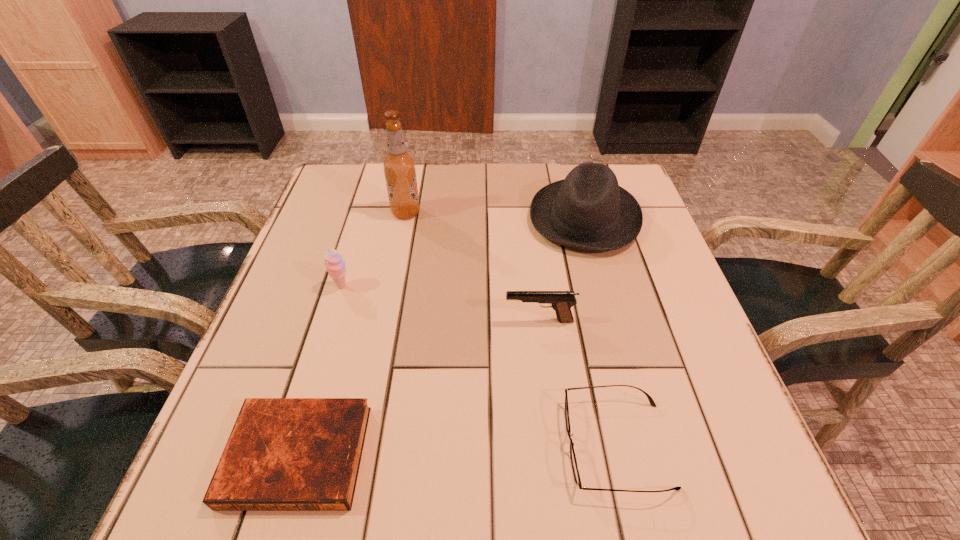
Identify the location of the tallest object. The image size is (960, 540). click(x=399, y=166).

Identify the location of fedora. This screenshot has height=540, width=960. (588, 210).

Locate an element on the screen. the fourth nearest object is located at coordinates (334, 262).

Where is `the third tallest object`? the third tallest object is located at coordinates (334, 262).

Locate an element on the screen. The image size is (960, 540). the third shortest object is located at coordinates (561, 301).

You are a GUI agent. You are given a task and a screenshot of the screen. Output one action in this format:
    pyautogui.click(x=<x>, y=<y>)
    Task: Click on the pistol
    
    Given the screenshot: What is the action you would take?
    pyautogui.click(x=561, y=301)

I want to click on the second shortest object, so click(576, 474).

The image size is (960, 540). What are the coordinates of `the shortest object` in the screenshot? It's located at (x=283, y=454).

The image size is (960, 540). Identify the location of vacant space located on the front label of the tallest object. (550, 213).

I want to click on free space located 0.050m on the left of the fedora, so click(510, 218).